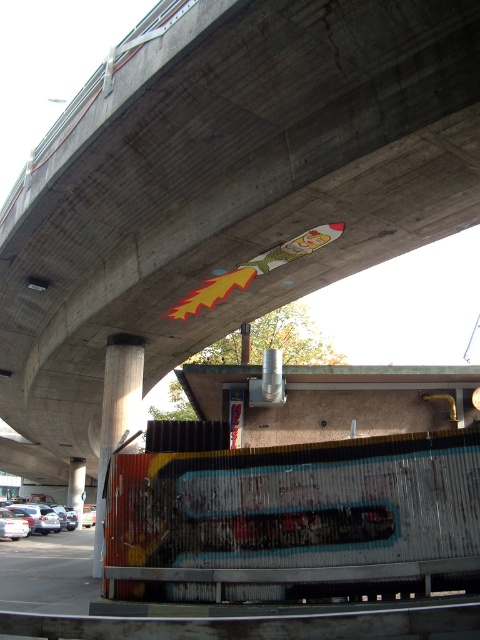
You are a delivery person who needs to park your 2.5 meters tall truck under the overpass. Looking at the scene, can you tell if the space between the rusty metal pillar at lower left and the silver metallic car at lower left is tall enough for your truck to pass through?

The rusty metal pillar at lower left is shorter than the silver metallic car at lower left. Since the truck is 2.5 meters tall, and the pillar is shorter than the car, but we don not know the exact height of the car or pillar, it is uncertain if the truck can pass through. More information is needed.

You are a delivery driver who needs to park your truck under the overpass. The truck is 3 meters tall. Can you safely park between the rusty metal pillar at lower left and the concrete pillar at center without hitting the pillars?

The rusty metal pillar at lower left is located above the concrete pillar at center, so the space between them may have limited vertical clearance. Since the truck is 3 meters tall, you need to ensure the vertical distance between the pillars is at least 3 meters. Without exact measurements, it is uncertain if the truck can safely pass. Check the actual height before proceeding.

You are standing at the base of the overpass and want to walk to the point marked as point (115, 420). However, there is an obstacle at point (28, 502). Which point should you avoid stepping on to reach your destination safely?

You should avoid stepping on point (28, 502) because it is farther away from you than point (115, 420), which is your destination. Since point (28, 502) is behind point (115, 420) from your perspective, stepping on it would take you away from your target location.